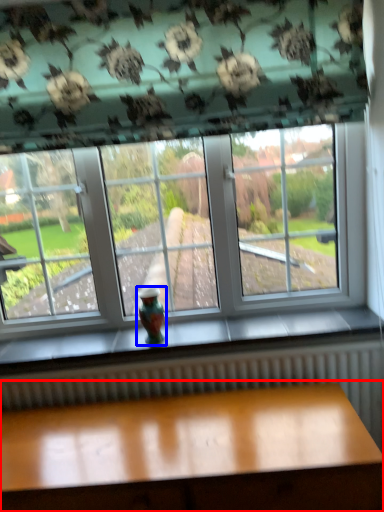
Question: Which object is further to the camera taking this photo, table (highlighted by a red box) or glass vase (highlighted by a blue box)?

Choices:
 (A) table
 (B) glass vase

Answer: (B)